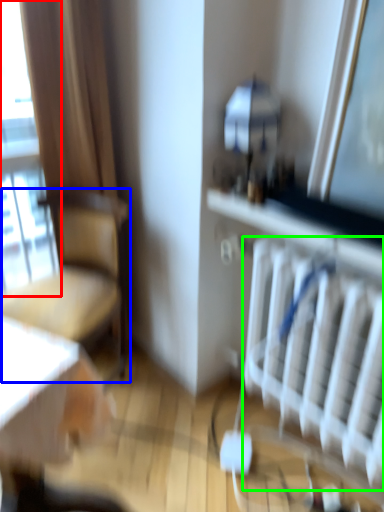
Question: Which object is positioned closest to window (highlighted by a red box)? Select from chair (highlighted by a blue box) and radiator (highlighted by a green box).

Choices:
 (A) chair
 (B) radiator

Answer: (A)